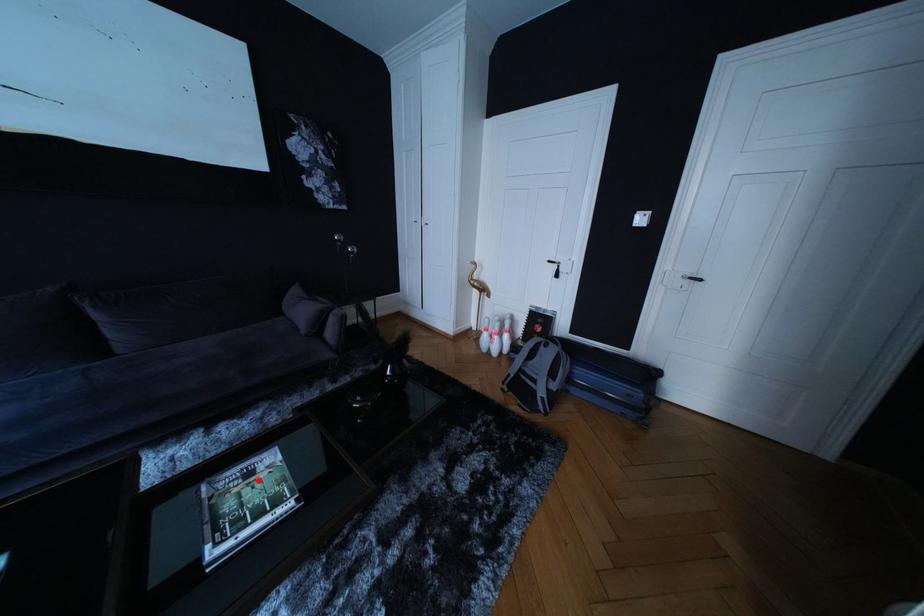
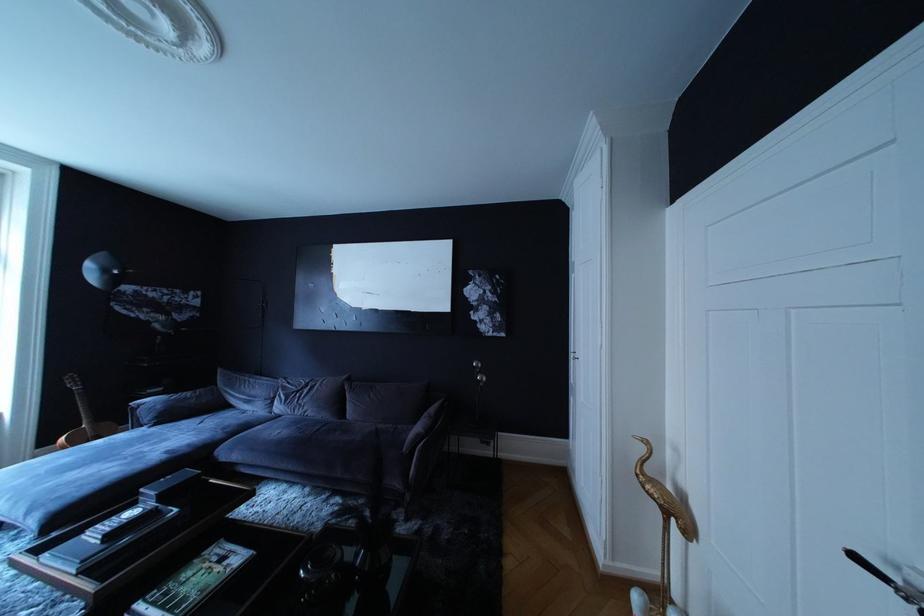
Locate, in the second image, the point that corresponds to the highlighted location in the first image.

(232, 565)